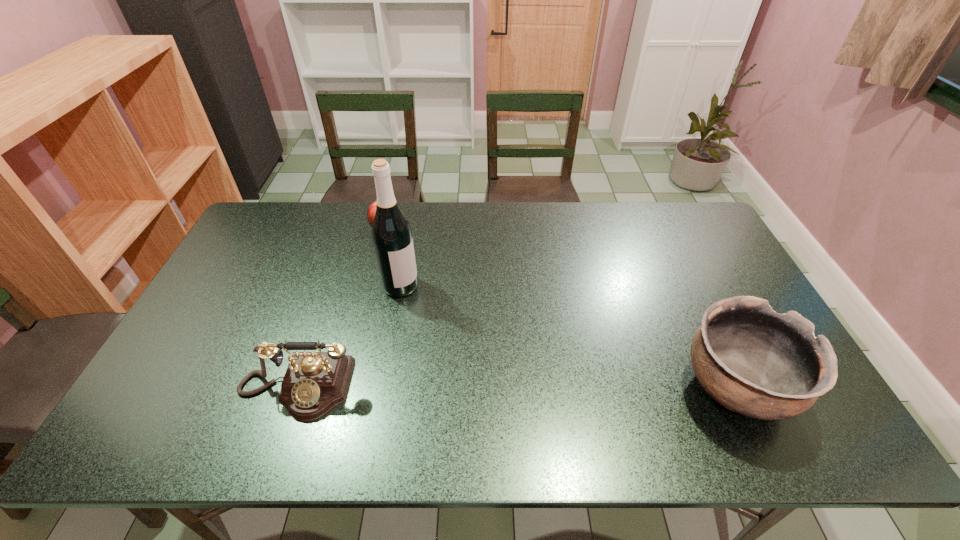
In order to click on free space at the far left corner in this screenshot , I will do `click(267, 208)`.

Locate an element on the screen. vacant space at the near left corner of the desktop is located at coordinates (191, 392).

The image size is (960, 540). I want to click on free space at the far right corner, so click(693, 237).

At what (x,y) coordinates should I click in order to perform the action: click on free space between the tallest object and the third tallest object. Please return your answer as a coordinate pair (x, y). Looking at the image, I should click on (348, 337).

Where is `free space between the farthest object and the pottery`? free space between the farthest object and the pottery is located at coordinates (561, 309).

At what (x,y) coordinates should I click in order to perform the action: click on free space between the telephone and the rightmost object. Please return your answer as a coordinate pair (x, y). Looking at the image, I should click on (516, 388).

Where is `free space between the rightmost object and the apple`? The image size is (960, 540). free space between the rightmost object and the apple is located at coordinates (561, 309).

Identify the location of empty space between the pottery and the telephone. This screenshot has width=960, height=540. (516, 388).

Image resolution: width=960 pixels, height=540 pixels. What are the coordinates of `free space between the telephone and the tallest object` in the screenshot? It's located at (348, 337).

The width and height of the screenshot is (960, 540). Identify the location of free space between the rightmost object and the wine bottle. (568, 336).